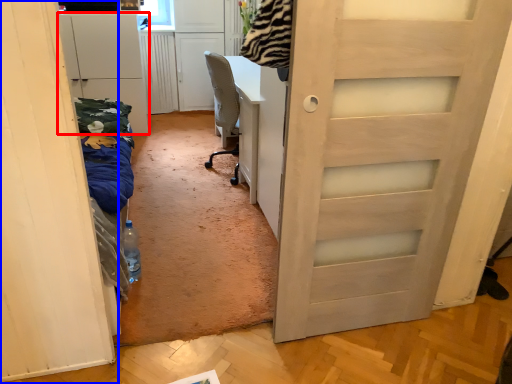
Question: Which point is further to the camera, cabinetry (highlighted by a red box) or door (highlighted by a blue box)?

Choices:
 (A) cabinetry
 (B) door

Answer: (A)